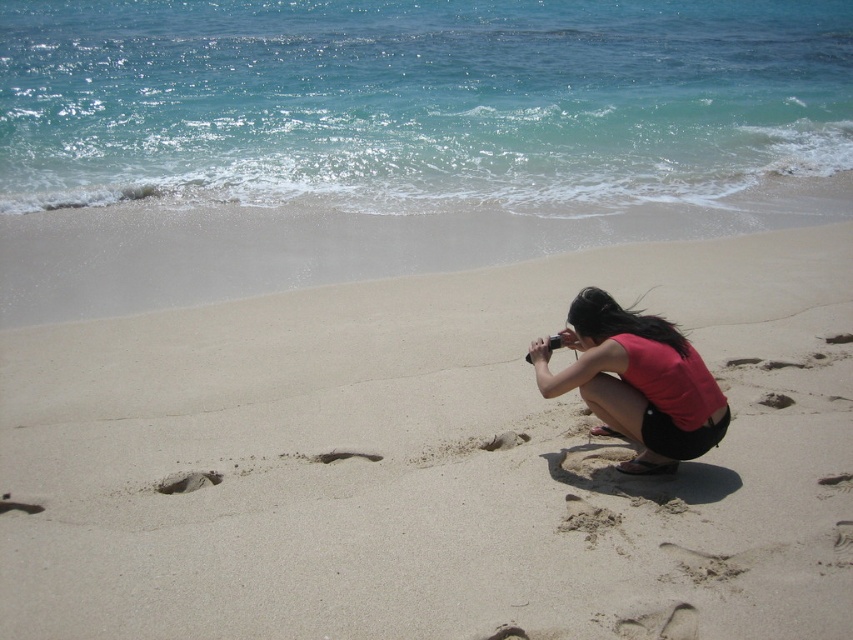
Can you confirm if matte red shirt at lower right is positioned above brown sandy footprint at center?

Correct, matte red shirt at lower right is located above brown sandy footprint at center.

Is matte red shirt at lower right positioned before brown sandy footprint at center?

Yes.

You are a GUI agent. You are given a task and a screenshot of the screen. Output one action in this format:
    pyautogui.click(x=<x>, y=<y>)
    Task: Click on the matte red shirt at lower right
    The width and height of the screenshot is (853, 640).
    Given the screenshot: What is the action you would take?
    pyautogui.click(x=636, y=381)

This screenshot has width=853, height=640. What are the coordinates of `matte red shirt at lower right` in the screenshot? It's located at (636, 381).

Does matte red shirt at lower right lie in front of brown sandy footprint at lower center?

Yes, matte red shirt at lower right is closer to the viewer.

Is point (708, 392) positioned behind point (770, 406)?

No, (708, 392) is closer to viewer.

Image resolution: width=853 pixels, height=640 pixels. I want to click on matte red shirt at lower right, so click(636, 381).

Who is positioned more to the right, beige sand at center or brown sandy footprint at center?

brown sandy footprint at center

Does beige sand at center have a smaller size compared to brown sandy footprint at center?

Actually, beige sand at center might be larger than brown sandy footprint at center.

You are a GUI agent. You are given a task and a screenshot of the screen. Output one action in this format:
    pyautogui.click(x=<x>, y=<y>)
    Task: Click on the beige sand at center
    The width and height of the screenshot is (853, 640).
    Given the screenshot: What is the action you would take?
    pyautogui.click(x=432, y=460)